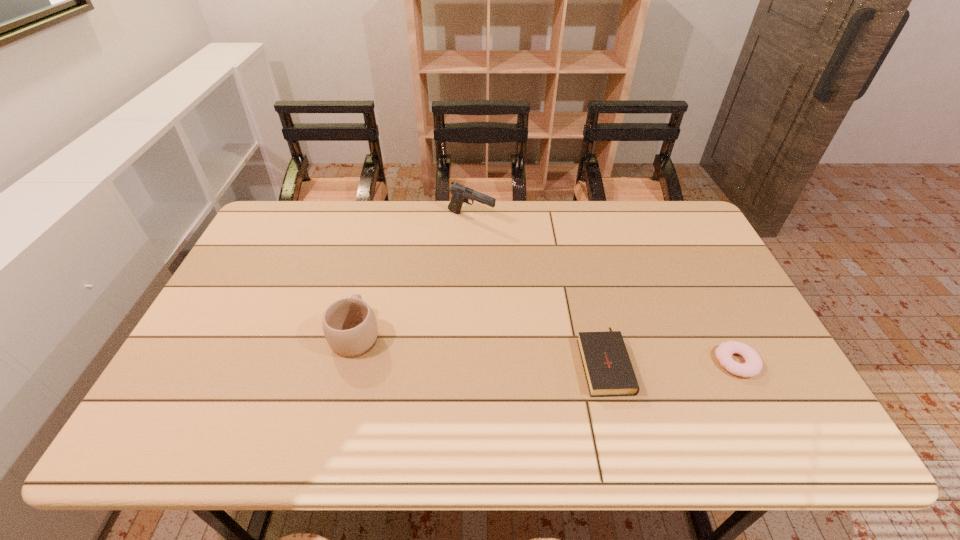
Locate an element on the screen. free space that is in between the doughnut and the gun is located at coordinates (604, 291).

This screenshot has height=540, width=960. In order to click on object that ranks as the third closest to the tallest object in this screenshot , I will do `click(753, 364)`.

This screenshot has height=540, width=960. I want to click on object that ranks as the closest to the third tallest object, so click(753, 364).

Image resolution: width=960 pixels, height=540 pixels. Identify the location of vacant region that satisfies the following two spatial constraints: 1. at the muzzle of the doughnut; 2. on the left side of the third object from right to left. (468, 362).

Identify the location of free location that satisfies the following two spatial constraints: 1. at the muzzle of the second object from left to right; 2. on the left side of the second object from right to left. (468, 360).

Find the location of `free point that satisfies the following two spatial constraints: 1. on the back side of the third object from left to right; 2. at the muzzle of the tallest object`. free point that satisfies the following two spatial constraints: 1. on the back side of the third object from left to right; 2. at the muzzle of the tallest object is located at coordinates (569, 219).

In order to click on vacant space that satisfies the following two spatial constraints: 1. at the muzzle of the shortest object; 2. on the right side of the gun in this screenshot , I will do `click(468, 362)`.

Find the location of a particular element. The width and height of the screenshot is (960, 540). free point that satisfies the following two spatial constraints: 1. at the muzzle of the Bible; 2. on the left side of the farthest object is located at coordinates (468, 360).

Locate an element on the screen. This screenshot has height=540, width=960. free location that satisfies the following two spatial constraints: 1. at the muzzle of the rightmost object; 2. on the left side of the tallest object is located at coordinates (468, 362).